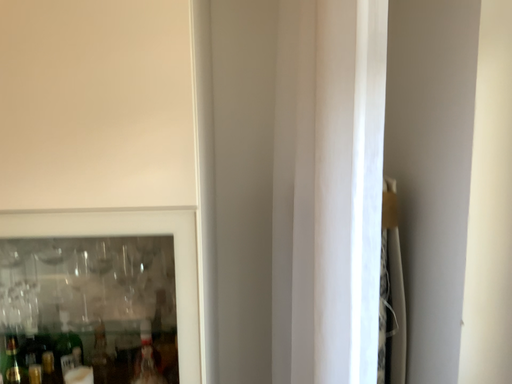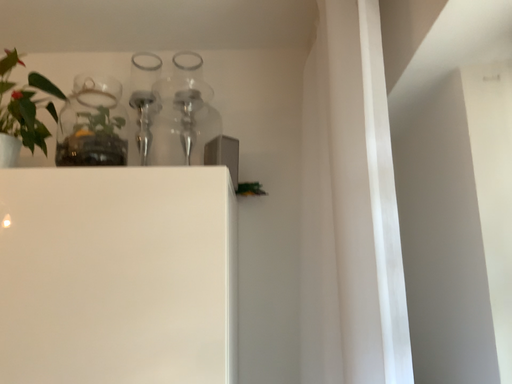
Question: How did the camera likely rotate when shooting the video?

Choices:
 (A) rotated upward
 (B) rotated downward

Answer: (A)